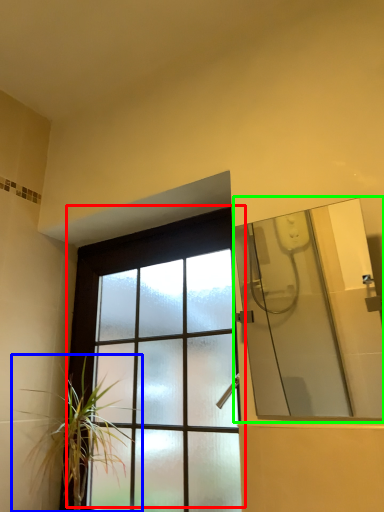
Question: Which object is the closest to the window (highlighted by a red box)? Choose among these: houseplant (highlighted by a blue box) or mirror (highlighted by a green box).

Choices:
 (A) houseplant
 (B) mirror

Answer: (A)